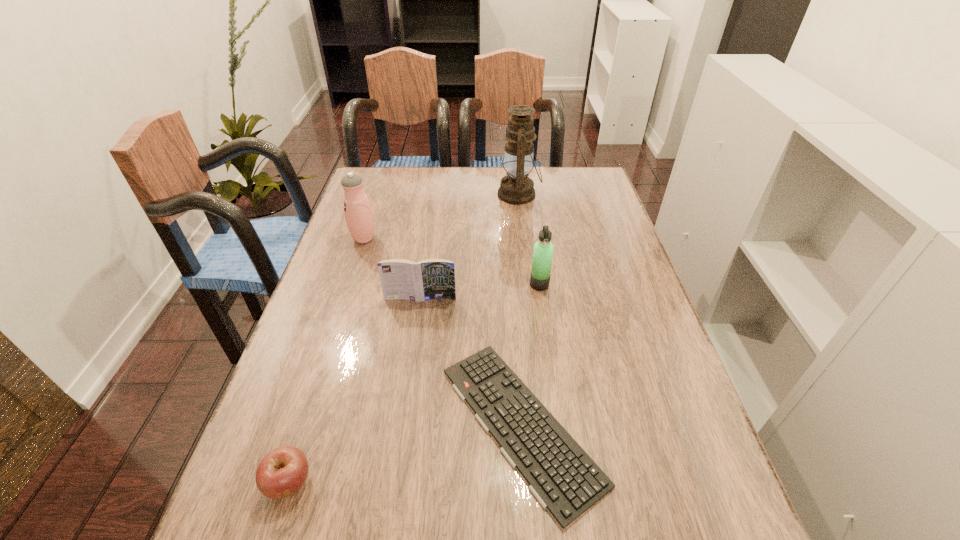
Identify which object is the fourth closest to the fifth tallest object. Please provide its 2D coordinates. Your answer should be formatted as a tuple, i.e. [(x, y)], where the tuple contains the x and y coordinates of a point satisfying the conditions above.

[(359, 217)]

Locate an element on the screen. Image resolution: width=960 pixels, height=540 pixels. blank area in the image that satisfies the following two spatial constraints: 1. on the back side of the farthest object; 2. on the left side of the left thermos bottle is located at coordinates (378, 194).

Locate an element on the screen. This screenshot has height=540, width=960. free space that satisfies the following two spatial constraints: 1. on the front side of the right thermos bottle; 2. on the right side of the left thermos bottle is located at coordinates (349, 285).

Identify the location of vacant region that satisfies the following two spatial constraints: 1. on the front cover of the shortest object; 2. on the right side of the book. (402, 424).